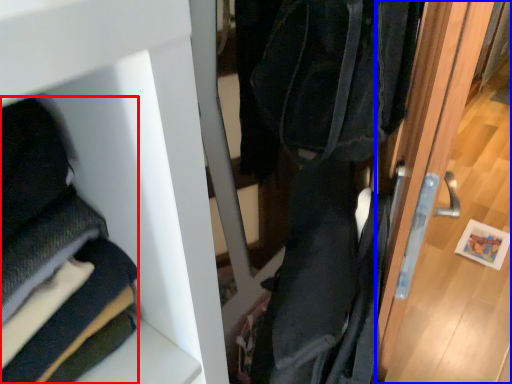
Question: Which point is further to the camera, cloak (highlighted by a red box) or door (highlighted by a blue box)?

Choices:
 (A) cloak
 (B) door

Answer: (B)